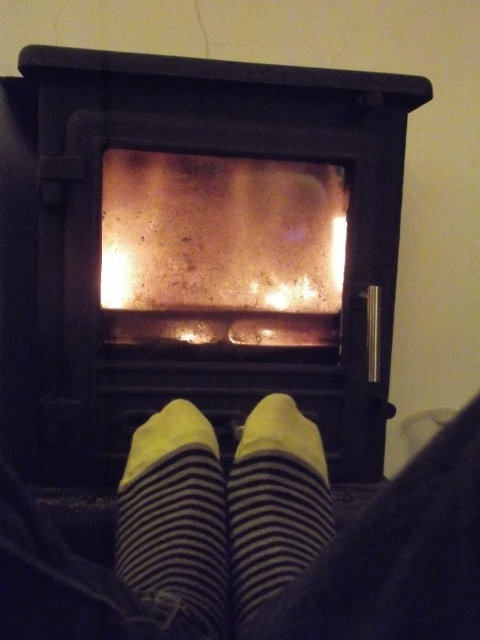
Is black matte fireplace at center closer to camera compared to yellow striped sock at center?

No, it is not.

Looking at this image, which is below, black matte fireplace at center or yellow striped sock at center?

yellow striped sock at center is lower down.

Does point (217, 131) come closer to viewer compared to point (197, 458)?

No, it is behind (197, 458).

I want to click on black matte fireplace at center, so click(195, 252).

Between black matte fireplace at center and striped cotton sock at center, which one has more height?

black matte fireplace at center

Which of these two, black matte fireplace at center or striped cotton sock at center, stands shorter?

striped cotton sock at center is shorter.

Is point (420, 84) in front of point (315, 544)?

No, (420, 84) is further to viewer.

The height and width of the screenshot is (640, 480). I want to click on black matte fireplace at center, so click(195, 252).

How much distance is there between yellow striped sock at center and striped cotton sock at center?

They are 2.50 inches apart.

Between point (224, 614) and point (324, 525), which one is positioned in front?

Point (224, 614) is in front.

The width and height of the screenshot is (480, 640). What are the coordinates of `yellow striped sock at center` in the screenshot? It's located at (176, 520).